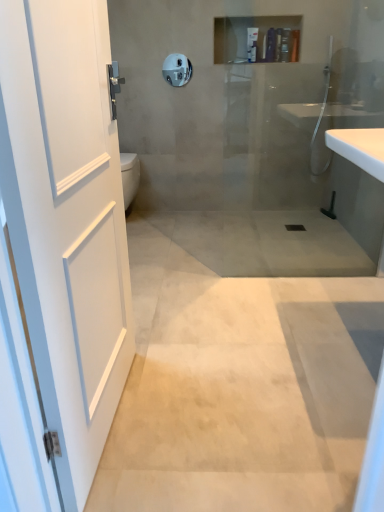
How much space does matte plastic shampoo bottle at upper center, marked as the first toiletry in a right-to-left arrangement, occupy horizontally?

3.72 inches.

What do you see at coordinates (252, 44) in the screenshot? I see `matte plastic bottle at upper center, the third toiletry in the right-to-left sequence` at bounding box center [252, 44].

Where is `white glossy sink at right`? Image resolution: width=384 pixels, height=512 pixels. white glossy sink at right is located at coordinates (360, 148).

At what (x,y) coordinates should I click in order to perform the action: click on white matte door at left. Please return your answer as a coordinate pair (x, y). This screenshot has height=512, width=384. Looking at the image, I should click on (67, 220).

From the image's perspective, which is above, satin nickel towel bar at upper center or white glossy sink at right?

satin nickel towel bar at upper center appears higher in the image.

Relative to white glossy sink at right, is satin nickel towel bar at upper center in front or behind?

satin nickel towel bar at upper center is positioned farther from the viewer than white glossy sink at right.

Looking at this image, is satin nickel towel bar at upper center bigger or smaller than white glossy sink at right?

In the image, satin nickel towel bar at upper center appears to be smaller than white glossy sink at right.

From a real-world perspective, is satin nickel towel bar at upper center on top of white glossy sink at right?

Yes, from a real-world perspective, satin nickel towel bar at upper center is on top of white glossy sink at right.

From the image's perspective, is matte plastic shampoo bottle at upper center, which is the third toiletry from left to right, above white matte door at left?

Yes, from the image's perspective, matte plastic shampoo bottle at upper center, which is the third toiletry from left to right, is over white matte door at left.

Which object is wider, matte plastic shampoo bottle at upper center, which is the third toiletry from left to right, or white matte door at left?

With larger width is matte plastic shampoo bottle at upper center, which is the third toiletry from left to right.

How different are the orientations of matte plastic shampoo bottle at upper center, marked as the first toiletry in a right-to-left arrangement, and white matte door at left in degrees?

85.4 degrees separate the facing orientations of matte plastic shampoo bottle at upper center, marked as the first toiletry in a right-to-left arrangement, and white matte door at left.

From a real-world perspective, is matte plastic shampoo bottle at upper center, which is the third toiletry from left to right, positioned above or below white matte door at left?

From a real-world perspective, matte plastic shampoo bottle at upper center, which is the third toiletry from left to right, is physically above white matte door at left.

Based on the photo, is white matte door at left with white glossy sink at right?

No.

Is white matte door at left situated inside white glossy sink at right or outside?

The correct answer is: outside.

Image resolution: width=384 pixels, height=512 pixels. I want to click on door below the white glossy sink at right (from a real-world perspective), so click(x=67, y=220).

Does white matte door at left lie behind white glossy sink at right?

No, it is in front of white glossy sink at right.

Considering the sizes of objects matte plastic shampoo bottle at upper center, which is the second toiletry from right to left, and beige polished concrete at center in the image provided, who is thinner, matte plastic shampoo bottle at upper center, which is the second toiletry from right to left, or beige polished concrete at center?

matte plastic shampoo bottle at upper center, which is the second toiletry from right to left, is thinner.

From the picture: Is matte plastic shampoo bottle at upper center, which is the second toiletry from right to left, with beige polished concrete at center?

There is a gap between matte plastic shampoo bottle at upper center, which is the second toiletry from right to left, and beige polished concrete at center.

From a real-world perspective, relative to beige polished concrete at center, is matte plastic shampoo bottle at upper center, which is the second toiletry from right to left, vertically above or below?

matte plastic shampoo bottle at upper center, which is the second toiletry from right to left, is above beige polished concrete at center.

This screenshot has width=384, height=512. What are the coordinates of `concrete below the matte plastic shampoo bottle at upper center, which is the second toiletry from right to left (from a real-world perspective)` in the screenshot? It's located at (242, 368).

You are a GUI agent. You are given a task and a screenshot of the screen. Output one action in this format:
    pyautogui.click(x=<x>, y=<y>)
    Task: Click on the 2nd toiletry behind the white matte door at left, counting from the anchor's position
    
    Given the screenshot: What is the action you would take?
    pyautogui.click(x=294, y=45)

Choose the correct answer: Is white matte door at left inside matte plastic shampoo bottle at upper center, marked as the first toiletry in a right-to-left arrangement, or outside it?

white matte door at left cannot be found inside matte plastic shampoo bottle at upper center, marked as the first toiletry in a right-to-left arrangement.

Considering the sizes of objects white matte door at left and matte plastic shampoo bottle at upper center, marked as the first toiletry in a right-to-left arrangement, in the image provided, who is shorter, white matte door at left or matte plastic shampoo bottle at upper center, marked as the first toiletry in a right-to-left arrangement,?

matte plastic shampoo bottle at upper center, marked as the first toiletry in a right-to-left arrangement.

Between white matte door at left and matte plastic shampoo bottle at upper center, marked as the first toiletry in a right-to-left arrangement, which one has larger width?

With larger width is matte plastic shampoo bottle at upper center, marked as the first toiletry in a right-to-left arrangement.

Would you say matte plastic shampoo bottle at upper center, which is the second toiletry from right to left, is outside satin nickel towel bar at upper center?

Yes, matte plastic shampoo bottle at upper center, which is the second toiletry from right to left, is located beyond the bounds of satin nickel towel bar at upper center.

Can you confirm if matte plastic shampoo bottle at upper center, which is the second toiletry from right to left, is bigger than satin nickel towel bar at upper center?

Correct, matte plastic shampoo bottle at upper center, which is the second toiletry from right to left, is larger in size than satin nickel towel bar at upper center.

Considering the positions of objects matte plastic shampoo bottle at upper center, which is the second toiletry from right to left, and satin nickel towel bar at upper center in the image provided, who is more to the right, matte plastic shampoo bottle at upper center, which is the second toiletry from right to left, or satin nickel towel bar at upper center?

Positioned to the right is matte plastic shampoo bottle at upper center, which is the second toiletry from right to left.

From their relative heights in the image, would you say matte plastic shampoo bottle at upper center, positioned as the second toiletry in left-to-right order, is taller or shorter than satin nickel towel bar at upper center?

Considering their sizes, matte plastic shampoo bottle at upper center, positioned as the second toiletry in left-to-right order, has less height than satin nickel towel bar at upper center.

Is matte plastic bottle at upper center, the first toiletry viewed from the left, inside the boundaries of white glossy sink at right, or outside?

matte plastic bottle at upper center, the first toiletry viewed from the left, exists outside the volume of white glossy sink at right.

Is matte plastic bottle at upper center, the first toiletry viewed from the left, bigger than white glossy sink at right?

Incorrect, matte plastic bottle at upper center, the first toiletry viewed from the left, is not larger than white glossy sink at right.

Is matte plastic bottle at upper center, the first toiletry viewed from the left, facing away from white glossy sink at right?

matte plastic bottle at upper center, the first toiletry viewed from the left, is not turned away from white glossy sink at right.

Identify the location of towel bar behind the white glossy sink at right. Image resolution: width=384 pixels, height=512 pixels. (177, 69).

Where is `door that is under the matte plastic shampoo bottle at upper center, which is the third toiletry from left to right (from a real-world perspective)`? Image resolution: width=384 pixels, height=512 pixels. door that is under the matte plastic shampoo bottle at upper center, which is the third toiletry from left to right (from a real-world perspective) is located at coordinates (67, 220).

Based on their spatial positions, is white glossy toilet bowl at left or matte plastic bottle at upper center, the first toiletry viewed from the left, closer to white glossy sink at right?

The object closer to white glossy sink at right is matte plastic bottle at upper center, the first toiletry viewed from the left.

Considering their positions, is white glossy toilet bowl at left positioned closer to beige polished concrete at center than satin nickel towel bar at upper center?

white glossy toilet bowl at left lies closer to beige polished concrete at center than the other object.

When comparing their distances from matte plastic shampoo bottle at upper center, which is the second toiletry from right to left, does beige polished concrete at center or white glossy toilet bowl at left seem closer?

white glossy toilet bowl at left.

Considering their positions, is white glossy sink at right positioned further to matte plastic shampoo bottle at upper center, marked as the first toiletry in a right-to-left arrangement, than matte plastic shampoo bottle at upper center, which is the second toiletry from right to left?

Based on the image, white glossy sink at right appears to be further to matte plastic shampoo bottle at upper center, marked as the first toiletry in a right-to-left arrangement.

Which object lies further to the anchor point white matte door at left, satin nickel towel bar at upper center or matte plastic bottle at upper center, the first toiletry viewed from the left?

Among the two, satin nickel towel bar at upper center is located further to white matte door at left.

From the picture: Considering their positions, is white glossy toilet bowl at left positioned closer to matte plastic bottle at upper center, the first toiletry viewed from the left, than beige polished concrete at center?

white glossy toilet bowl at left.

Looking at the image, which one is located closer to white glossy sink at right, satin nickel towel bar at upper center or beige polished concrete at center?

beige polished concrete at center lies closer to white glossy sink at right than the other object.

Based on their spatial positions, is white glossy toilet bowl at left or white matte door at left closer to beige polished concrete at center?

white matte door at left.

The height and width of the screenshot is (512, 384). Find the location of `concrete between white matte door at left and white glossy toilet bowl at left along the z-axis`. concrete between white matte door at left and white glossy toilet bowl at left along the z-axis is located at coordinates (242, 368).

Identify the location of towel bar between white glossy toilet bowl at left and matte plastic shampoo bottle at upper center, which is the third toiletry from left to right, in the horizontal direction. (177, 69).

Where is `toilet bowl positioned between white glossy sink at right and matte plastic bottle at upper center, the first toiletry viewed from the left, from near to far`? toilet bowl positioned between white glossy sink at right and matte plastic bottle at upper center, the first toiletry viewed from the left, from near to far is located at coordinates tap(129, 176).

Where is `towel bar that lies between matte plastic bottle at upper center, the third toiletry in the right-to-left sequence, and white glossy toilet bowl at left from top to bottom`? The width and height of the screenshot is (384, 512). towel bar that lies between matte plastic bottle at upper center, the third toiletry in the right-to-left sequence, and white glossy toilet bowl at left from top to bottom is located at coordinates point(177,69).